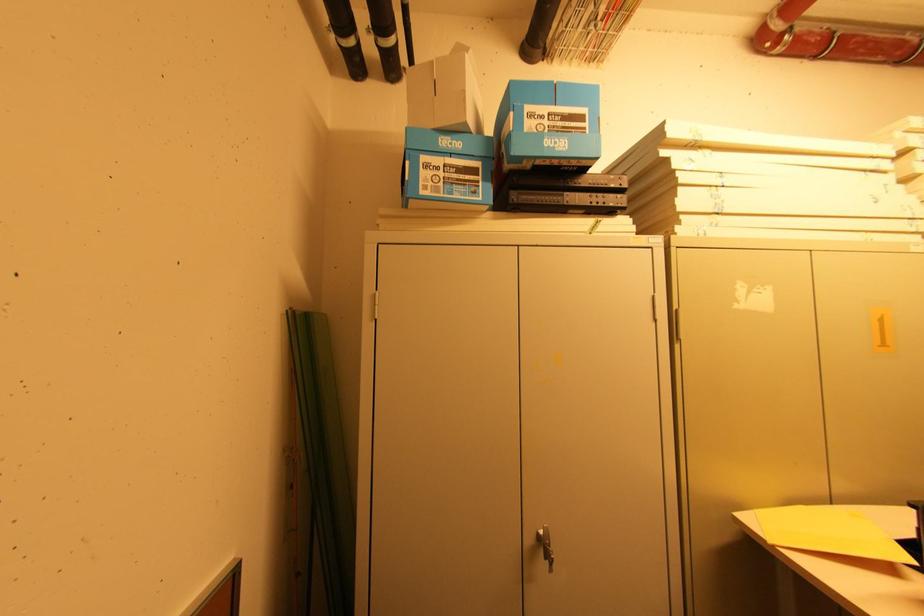
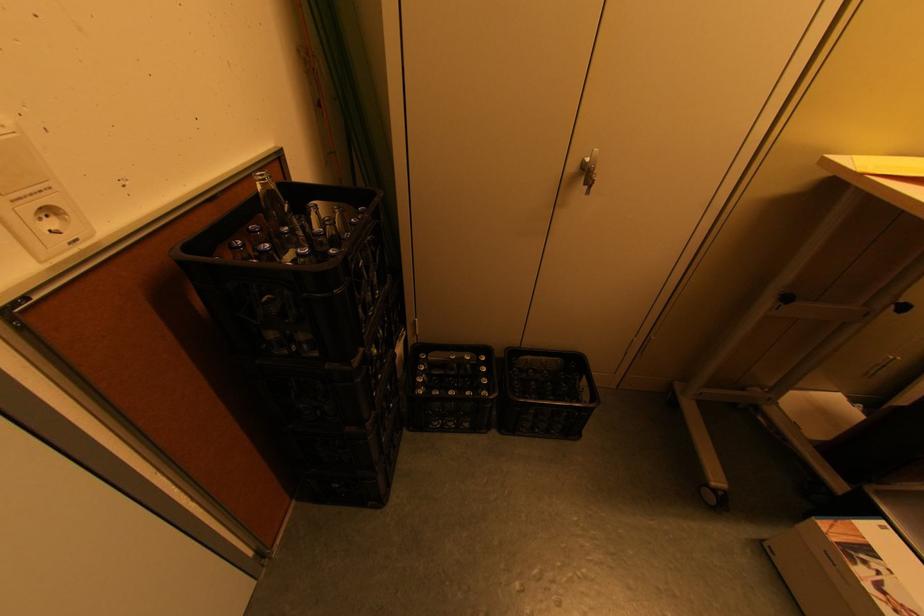
Where in the second image is the point corresponding to point 549,560 from the first image?

(588, 185)